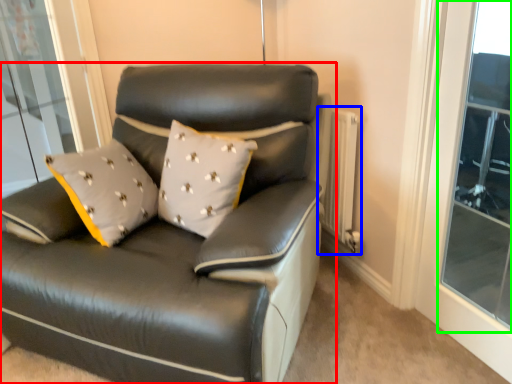
Question: Based on their relative distances, which object is farther from studio couch (highlighted by a red box)? Choose from radiator (highlighted by a blue box) and window (highlighted by a green box).

Choices:
 (A) radiator
 (B) window

Answer: (B)